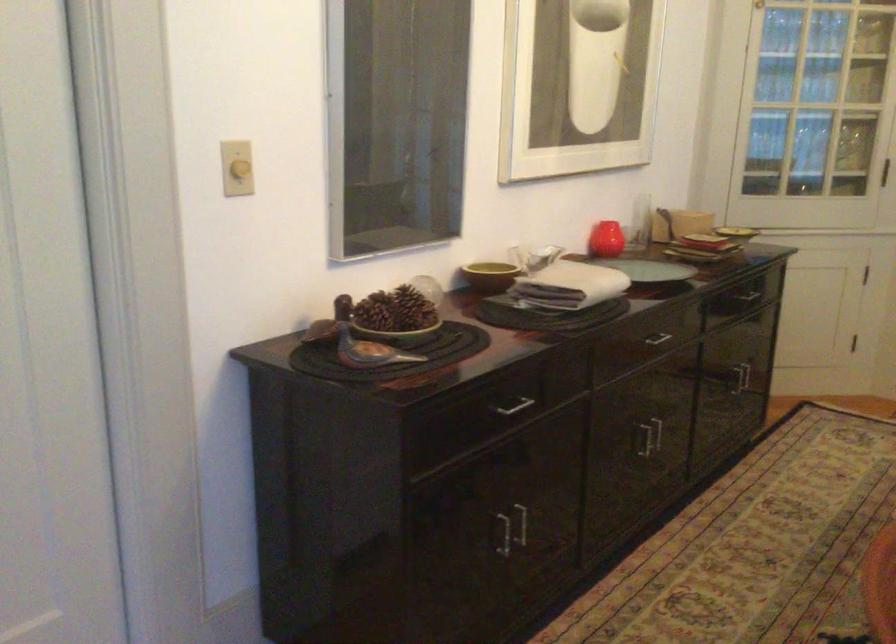
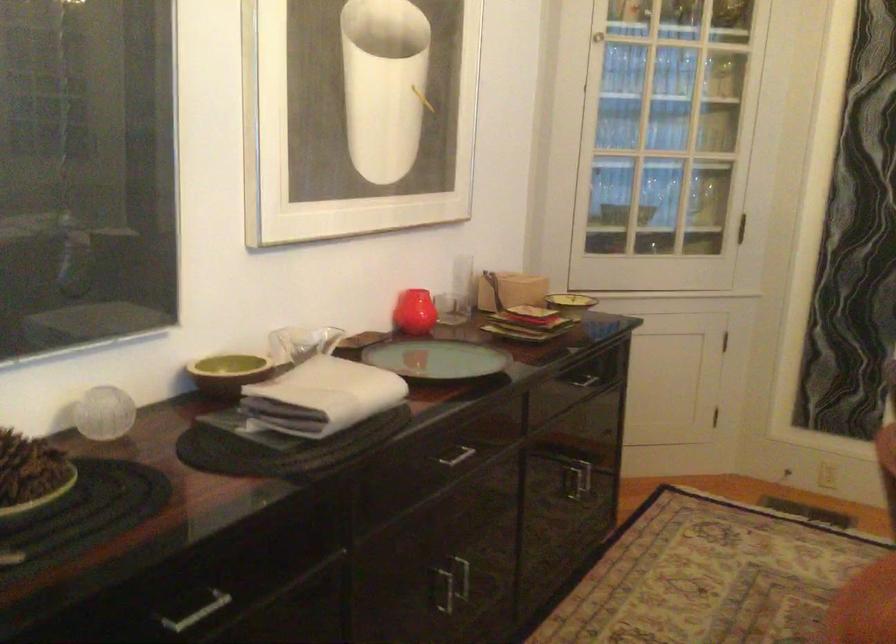
Locate, in the second image, the point that corresponds to point 493,270 in the first image.

(228, 373)